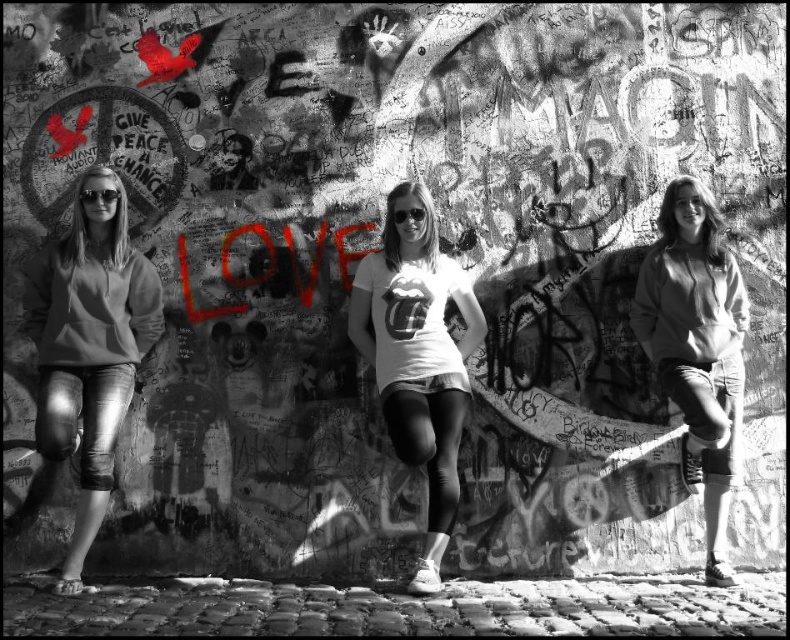
You are a photographer trying to capture the graffiti wall. You notice the denim jeans at left and denim shorts at center. Which clothing item is closer to the camera?

The denim jeans at left is positioned under the denim shorts at center, meaning it is closer to the camera.

Consider the image. You are a photographer trying to capture the graffiti wall. You need to ensure that both the denim jeans at left and denim shorts at center are visible in the frame. Based on their positions, which direction should you move to include both in the photo?

Since the denim jeans at left is to the left of denim shorts at center, you should move to the left to include both the denim jeans at left and denim shorts at center in the frame.